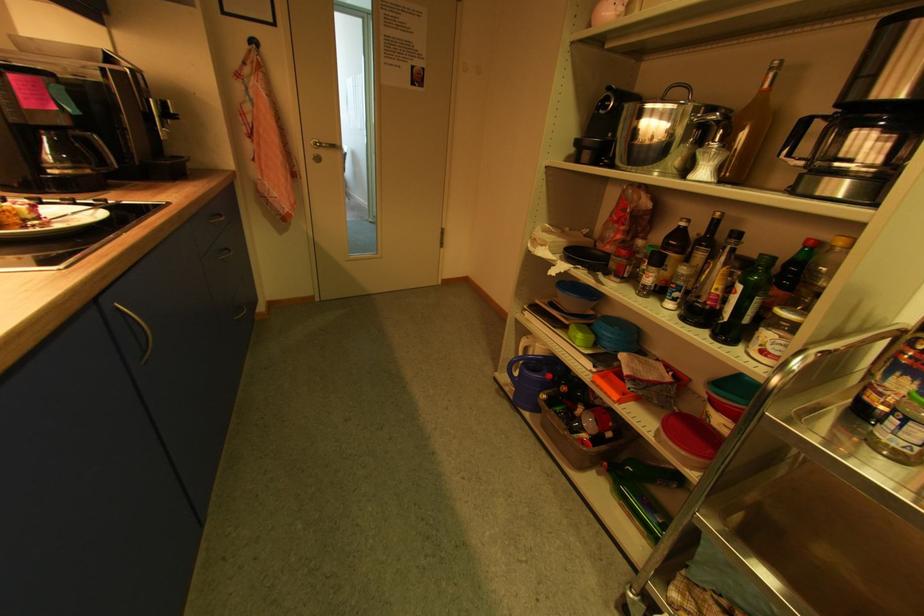
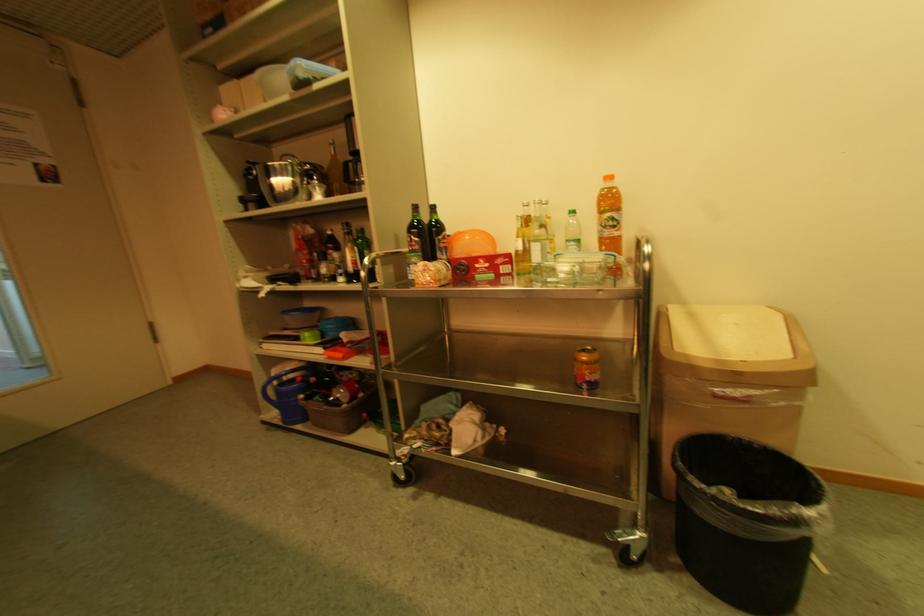
Question: Based on the continuous images, in which direction is the camera rotating? Reply with the corresponding letter.

Choices:
 (A) Left
 (B) Right
 (C) Up
 (D) Down

Answer: (B)